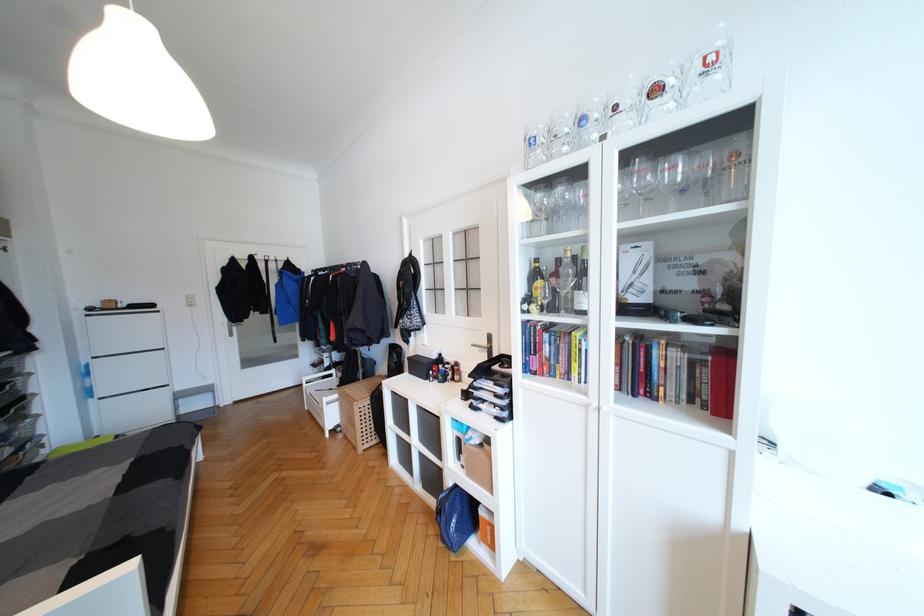
The height and width of the screenshot is (616, 924). What do you see at coordinates (485, 345) in the screenshot? I see `a silver door handle` at bounding box center [485, 345].